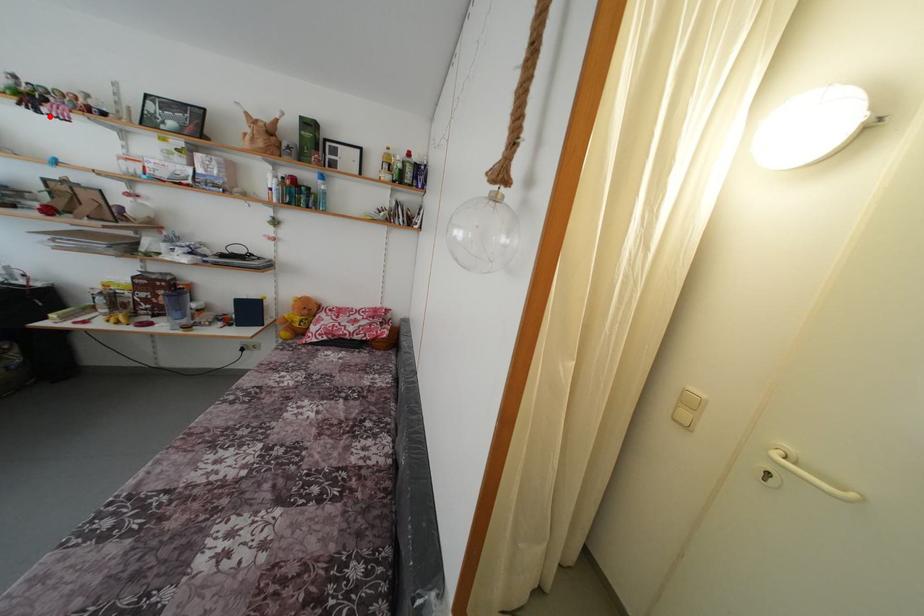
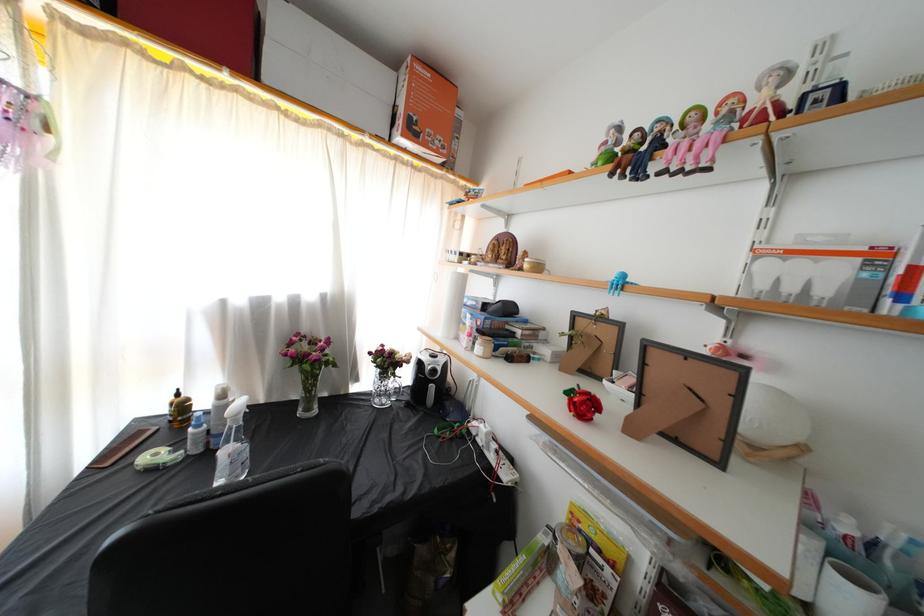
Question: A red point is marked in image1. In image2, is the corresponding 3D point closer to the camera or farther? Reply with the corresponding letter.

Choices:
 (A) The corresponding 3D point is closer.
 (B) The corresponding 3D point is farther.

Answer: (A)